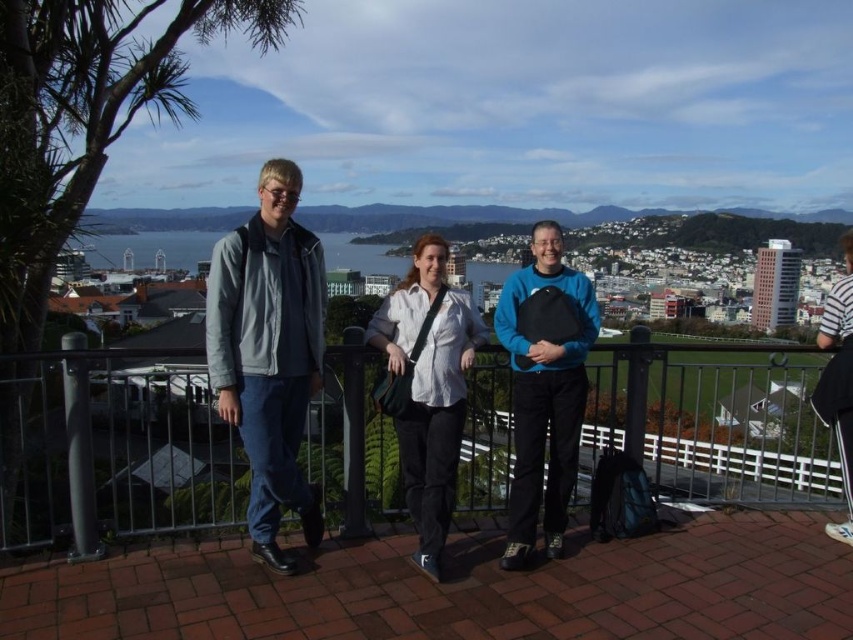
You are a fashion designer analyzing the image. You need to determine the exact position of the teal matte sweater at center. What are its coordinates?

The teal matte sweater at center is located at point (544,387).

You are a photographer trying to capture a photo of the scenic urban landscape. You notice two people in the group wearing the teal matte sweater at center and the white striped shirt at upper right. Which person is positioned to the left of the other?

The teal matte sweater at center is to the left of the white striped shirt at upper right.

You are a photographer standing behind the group of three individuals on the brick platform. You want to take a photo that focuses on the person wearing the white cotton shirt at center without the white striped shirt at upper right appearing in the foreground. Is this possible?

The white cotton shirt at center is closer to the viewer than the white striped shirt at upper right. Therefore, the white striped shirt at upper right will not be in the foreground, so you can take a photo focusing on the white cotton shirt at center without the white striped shirt at upper right appearing in the foreground.